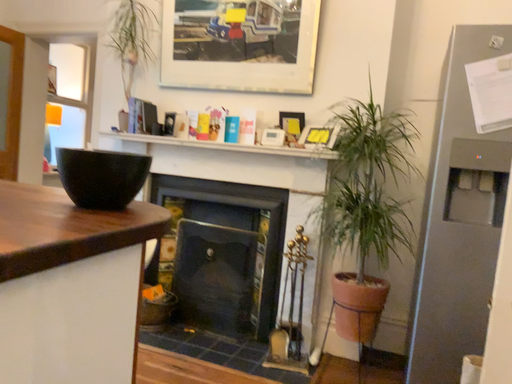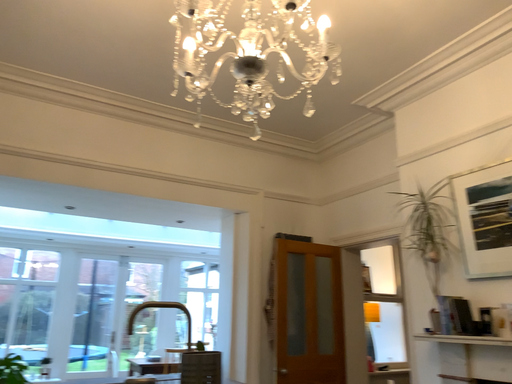
Question: Which way did the camera rotate in the video?

Choices:
 (A) rotated left
 (B) rotated right

Answer: (A)